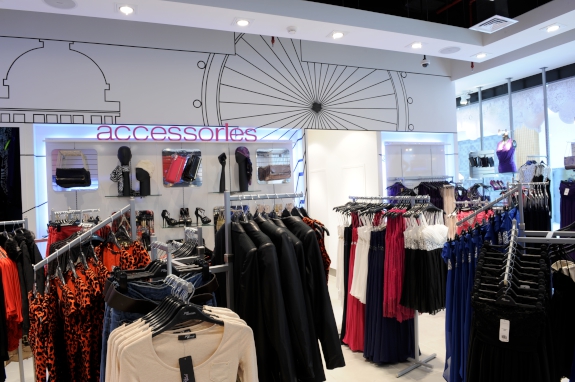
Identify the location of floor. (431, 331), (360, 372), (331, 279), (28, 369).